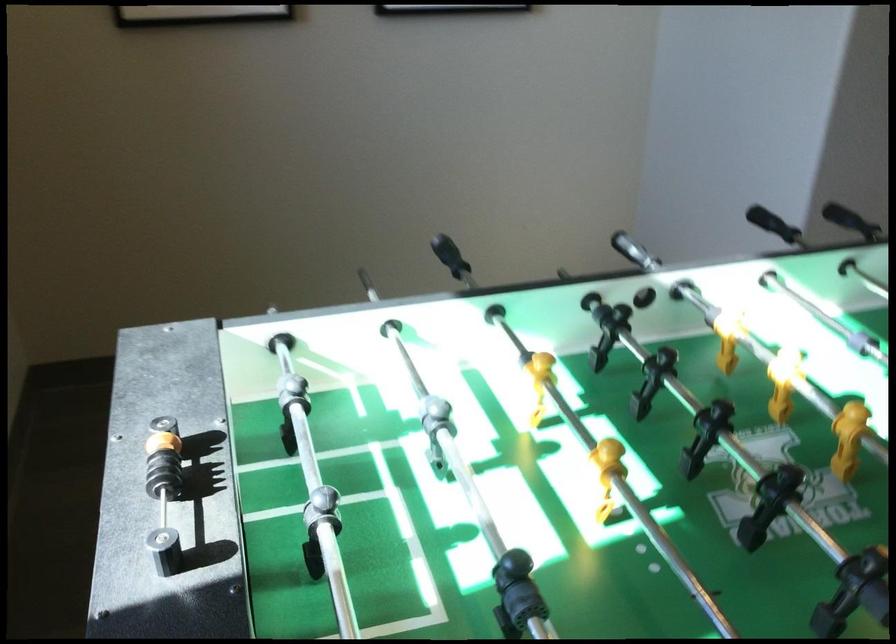
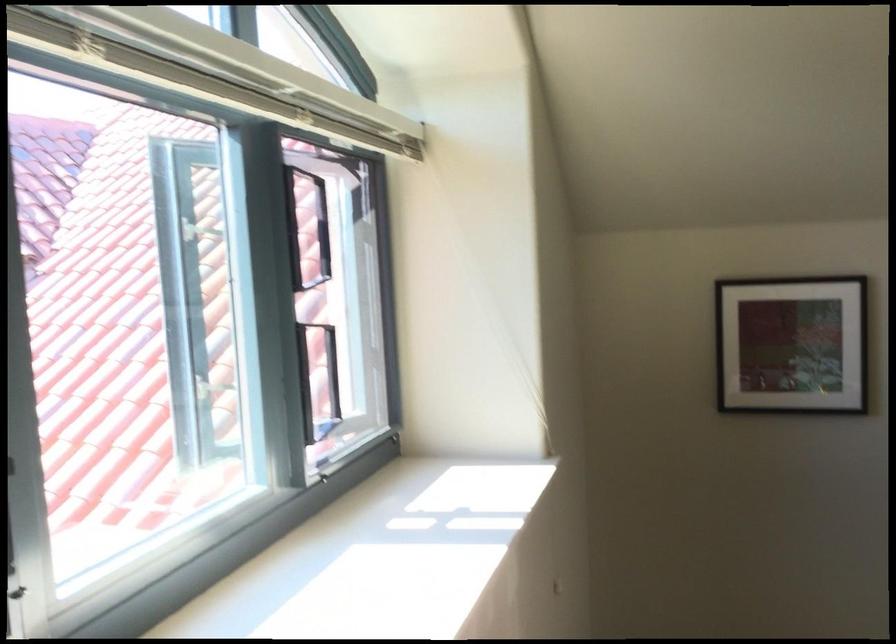
The first image is from the beginning of the video and the second image is from the end. How did the camera likely rotate when shooting the video?

The rotation direction of the camera is left-up.